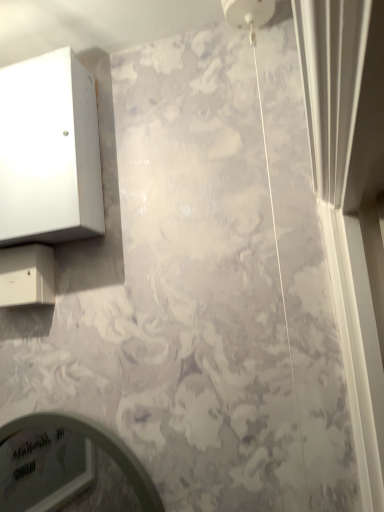
Where is `white matte medicine cabinet at upper left`? This screenshot has width=384, height=512. white matte medicine cabinet at upper left is located at coordinates (49, 151).

What do you see at coordinates (49, 151) in the screenshot?
I see `white matte medicine cabinet at upper left` at bounding box center [49, 151].

Where is `white matte medicine cabinet at upper left`? The width and height of the screenshot is (384, 512). white matte medicine cabinet at upper left is located at coordinates (49, 151).